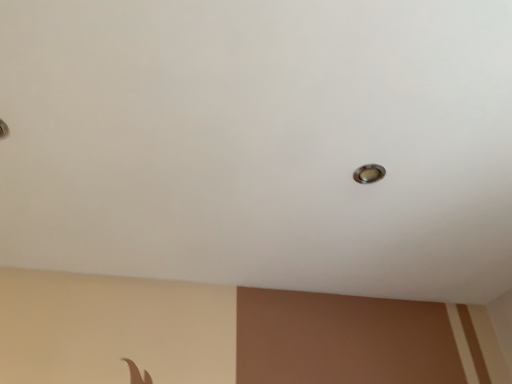
Locate an element on the screen. The image size is (512, 384). satin silver droplight at upper center is located at coordinates (369, 173).

Describe the element at coordinates (369, 173) in the screenshot. I see `satin silver droplight at upper center` at that location.

Identify the location of satin silver droplight at upper center. (369, 173).